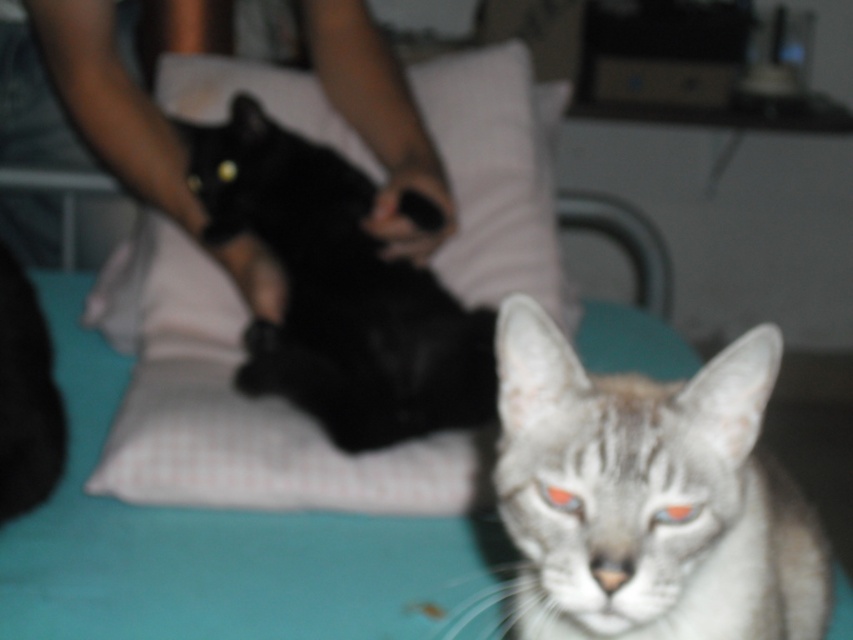
Does white checkered pillow at upper center have a lesser height compared to shiny orange eye at center?

No.

This screenshot has height=640, width=853. In order to click on white checkered pillow at upper center in this screenshot , I will do `click(497, 176)`.

Does point (142, 218) come farther from viewer compared to point (570, 493)?

Yes.

Where is `white checkered pillow at upper center`? Image resolution: width=853 pixels, height=640 pixels. white checkered pillow at upper center is located at coordinates (497, 176).

Can you confirm if shiny black cat at center is positioned to the right of white checkered pillow at upper center?

No, shiny black cat at center is not to the right of white checkered pillow at upper center.

Can you confirm if shiny black cat at center is taller than white checkered pillow at upper center?

No, shiny black cat at center is not taller than white checkered pillow at upper center.

Is point (352, 205) closer to camera compared to point (183, 253)?

Yes, it is in front of point (183, 253).

The width and height of the screenshot is (853, 640). In order to click on shiny black cat at center in this screenshot , I will do `click(339, 292)`.

Which of these two, white checkered pillow at upper center or shiny blue eye at center, stands taller?

white checkered pillow at upper center

Which is more to the left, white checkered pillow at upper center or shiny blue eye at center?

white checkered pillow at upper center

This screenshot has width=853, height=640. Describe the element at coordinates (497, 176) in the screenshot. I see `white checkered pillow at upper center` at that location.

Where is `white checkered pillow at upper center`? white checkered pillow at upper center is located at coordinates (497, 176).